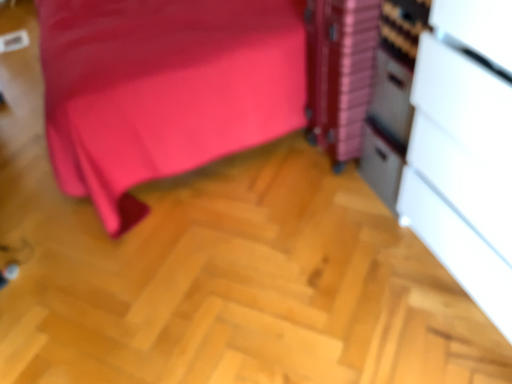
Question: Could you tell me if metallic silver file cabinet at right, the first file cabinet positioned from the back, is facing white matte/file cabinet at right, the first file cabinet from the front?

Choices:
 (A) yes
 (B) no

Answer: (B)

Question: Does metallic silver file cabinet at right, the first file cabinet positioned from the back, have a lesser height compared to white matte/file cabinet at right, the first file cabinet from the front?

Choices:
 (A) yes
 (B) no

Answer: (A)

Question: Can you confirm if metallic silver file cabinet at right, which is counted as the 2th file cabinet, starting from the front, is taller than white matte/file cabinet at right, the first file cabinet from the front?

Choices:
 (A) no
 (B) yes

Answer: (A)

Question: Is metallic silver file cabinet at right, the first file cabinet positioned from the back, bigger than white matte/file cabinet at right, the first file cabinet from the front?

Choices:
 (A) no
 (B) yes

Answer: (A)

Question: Does metallic silver file cabinet at right, which is counted as the 2th file cabinet, starting from the front, have a lesser width compared to white matte/file cabinet at right, the first file cabinet from the front?

Choices:
 (A) yes
 (B) no

Answer: (A)

Question: Is the depth of metallic silver file cabinet at right, the first file cabinet positioned from the back, greater than that of white matte/file cabinet at right, the first file cabinet from the front?

Choices:
 (A) yes
 (B) no

Answer: (A)

Question: Does white matte/file cabinet at right, the first file cabinet from the front, lie behind metallic silver file cabinet at right, the first file cabinet positioned from the back?

Choices:
 (A) yes
 (B) no

Answer: (B)

Question: Is white matte/file cabinet at right, which is the 2th file cabinet in back-to-front order, outside metallic silver file cabinet at right, the first file cabinet positioned from the back?

Choices:
 (A) no
 (B) yes

Answer: (B)

Question: Considering the relative sizes of white matte/file cabinet at right, which is the 2th file cabinet in back-to-front order, and metallic silver file cabinet at right, which is counted as the 2th file cabinet, starting from the front, in the image provided, is white matte/file cabinet at right, which is the 2th file cabinet in back-to-front order, thinner than metallic silver file cabinet at right, which is counted as the 2th file cabinet, starting from the front,?

Choices:
 (A) yes
 (B) no

Answer: (B)

Question: From a real-world perspective, is white matte/file cabinet at right, the first file cabinet from the front, located higher than metallic silver file cabinet at right, which is counted as the 2th file cabinet, starting from the front?

Choices:
 (A) no
 (B) yes

Answer: (B)

Question: Does white matte/file cabinet at right, the first file cabinet from the front, have a smaller size compared to metallic silver file cabinet at right, which is counted as the 2th file cabinet, starting from the front?

Choices:
 (A) no
 (B) yes

Answer: (A)

Question: Is white matte/file cabinet at right, which is the 2th file cabinet in back-to-front order, far from metallic silver file cabinet at right, the first file cabinet positioned from the back?

Choices:
 (A) no
 (B) yes

Answer: (A)

Question: In the image, is white matte/file cabinet at right, the first file cabinet from the front, positioned in front of or behind metallic silver file cabinet at right, the first file cabinet positioned from the back?

Choices:
 (A) behind
 (B) front

Answer: (B)